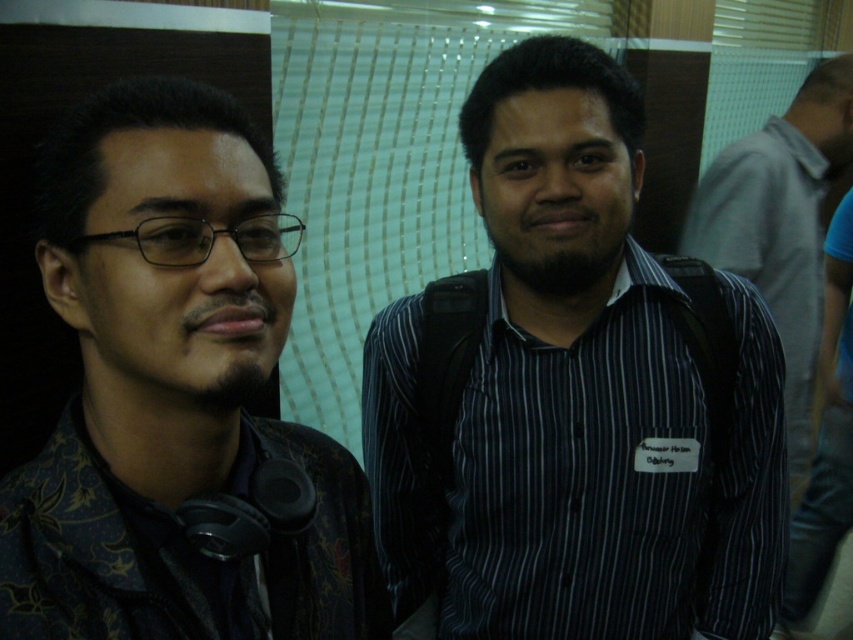
You are organizing a photo album and need to place the dark striped shirt at center and the matte black headphones at left into separate compartments. The shirt compartment must be bigger than the headphones compartment. Based on the image, will the compartments be appropriately sized?

The dark striped shirt at center is larger in size than the matte black headphones at left, so the compartment for the dark striped shirt at center should be bigger than the one for the matte black headphones at left, making the compartments appropriately sized.

You are a photographer at an event and need to take a portrait of both the dark striped shirt at center and the matte black headphones at left. The minimum distance required for your camera to focus is 14 inches. Will the camera be able to focus on both subjects simultaneously?

The dark striped shirt at center is 13.99 inches away from matte black headphones at left. Since the distance between them is less than the camera minimum focusing distance of 14 inches, the camera will not be able to focus on both subjects simultaneously.